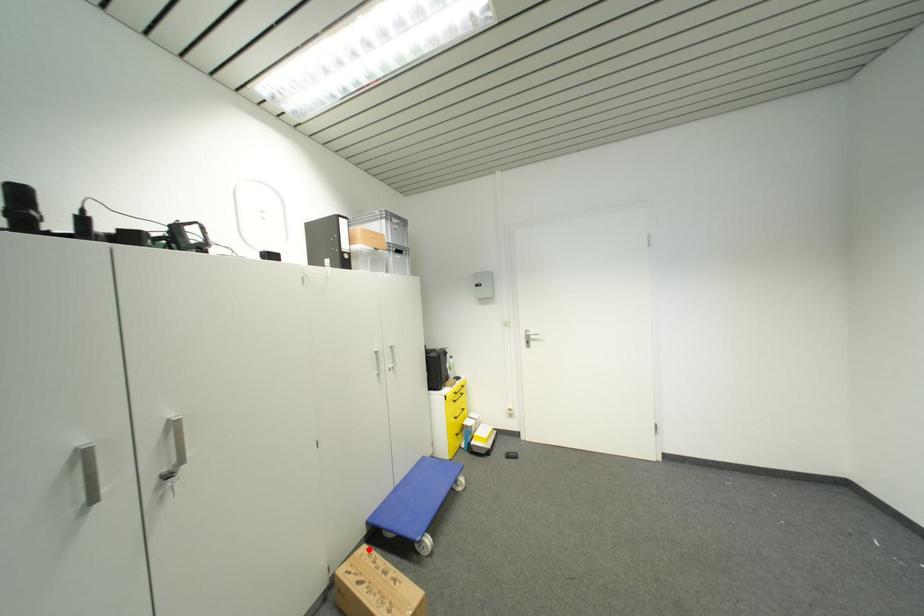
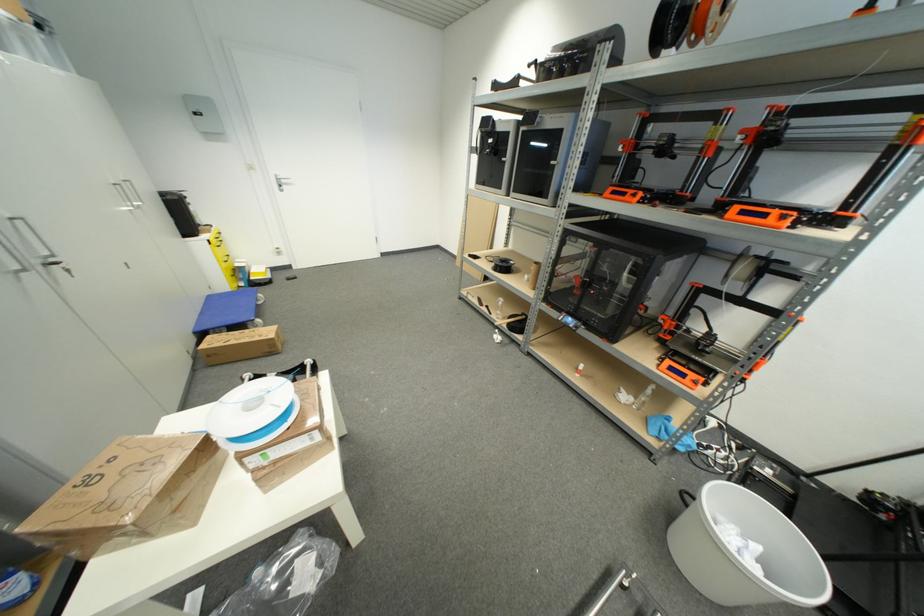
Locate, in the second image, the point that corresponds to the highlighted location in the first image.

(213, 339)